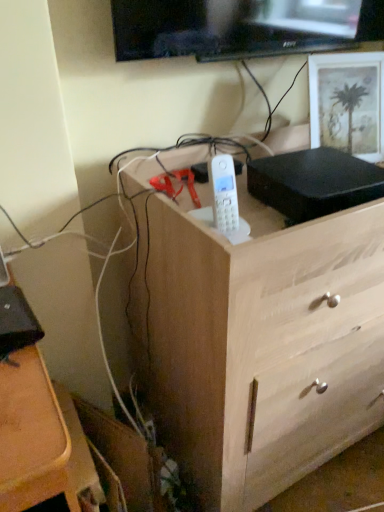
This screenshot has height=512, width=384. What do you see at coordinates (259, 342) in the screenshot?
I see `wooden chest of drawers at center` at bounding box center [259, 342].

Measure the distance between point [381,224] and camera.

The distance of point [381,224] from camera is 33.31 inches.

Where is `wooden chest of drawers at center`? This screenshot has height=512, width=384. wooden chest of drawers at center is located at coordinates (259, 342).

What is the approximate height of wooden chest of drawers at center?

It is 36.06 inches.

In order to face wooden chest of drawers at center, should I rotate leftwards or rightwards?

To align with it, rotate right about 13.432°.

This screenshot has height=512, width=384. Identify the location of white matte picture frame at upper right. (348, 103).

The width and height of the screenshot is (384, 512). What do you see at coordinates (348, 103) in the screenshot?
I see `white matte picture frame at upper right` at bounding box center [348, 103].

At what (x,y) coordinates should I click in order to perform the action: click on wooden chest of drawers at center. Please return your answer as a coordinate pair (x, y). Looking at the image, I should click on (259, 342).

Between white matte picture frame at upper right and wooden chest of drawers at center, which one appears on the left side from the viewer's perspective?

wooden chest of drawers at center.

Considering the positions of objects white matte picture frame at upper right and wooden chest of drawers at center in the image provided, who is behind, white matte picture frame at upper right or wooden chest of drawers at center?

white matte picture frame at upper right is further from the camera.

Considering the points (310, 106) and (218, 346), which point is behind, point (310, 106) or point (218, 346)?

The point (310, 106) is farther.

From the image's perspective, who appears lower, white matte picture frame at upper right or wooden chest of drawers at center?

wooden chest of drawers at center is shown below in the image.

From a real-world perspective, between white matte picture frame at upper right and wooden chest of drawers at center, who is vertically higher?

In real-world perspective, white matte picture frame at upper right is above.

In the scene shown: Is white matte picture frame at upper right thinner than wooden chest of drawers at center?

Yes.

Considering the sizes of objects white matte picture frame at upper right and wooden chest of drawers at center in the image provided, who is shorter, white matte picture frame at upper right or wooden chest of drawers at center?

With less height is white matte picture frame at upper right.

Considering the sizes of objects white matte picture frame at upper right and wooden chest of drawers at center in the image provided, who is smaller, white matte picture frame at upper right or wooden chest of drawers at center?

With smaller size is white matte picture frame at upper right.

Can wooden chest of drawers at center be found inside white matte picture frame at upper right?

No, wooden chest of drawers at center is not a part of white matte picture frame at upper right.

Based on the photo, are white matte picture frame at upper right and wooden chest of drawers at center far apart?

No, white matte picture frame at upper right is not far from wooden chest of drawers at center.

Is white matte picture frame at upper right oriented away from wooden chest of drawers at center?

No, wooden chest of drawers at center is not at the back of white matte picture frame at upper right.

What's the angular difference between white matte picture frame at upper right and wooden chest of drawers at center's facing directions?

white matte picture frame at upper right and wooden chest of drawers at center are facing 17.4 degrees away from each other.

How distant is white matte picture frame at upper right from wooden chest of drawers at center?

20.15 inches.

Find the location of `picture frame above the wooden chest of drawers at center (from a real-world perspective)`. picture frame above the wooden chest of drawers at center (from a real-world perspective) is located at coordinates (348, 103).

In the image, is wooden chest of drawers at center on the left side or the right side of white matte picture frame at upper right?

Based on their positions, wooden chest of drawers at center is located to the left of white matte picture frame at upper right.

Considering the positions of objects wooden chest of drawers at center and white matte picture frame at upper right in the image provided, who is in front, wooden chest of drawers at center or white matte picture frame at upper right?

wooden chest of drawers at center.

Between point (280, 367) and point (316, 135), which one is positioned in front?

The point (280, 367) is closer to the camera.

From the image's perspective, is wooden chest of drawers at center on top of white matte picture frame at upper right?

No.

Consider the image. From a real-world perspective, who is located higher, wooden chest of drawers at center or white matte picture frame at upper right?

From a 3D spatial view, white matte picture frame at upper right is above.

Which of these two, wooden chest of drawers at center or white matte picture frame at upper right, is wider?

With larger width is wooden chest of drawers at center.

Based on the photo, from their relative heights in the image, would you say wooden chest of drawers at center is taller or shorter than white matte picture frame at upper right?

In the image, wooden chest of drawers at center appears to be taller than white matte picture frame at upper right.

Between wooden chest of drawers at center and white matte picture frame at upper right, which one has larger size?

wooden chest of drawers at center.

Consider the image. Is white matte picture frame at upper right inside wooden chest of drawers at center?

Yes, white matte picture frame at upper right is surrounded by wooden chest of drawers at center.

Is wooden chest of drawers at center touching white matte picture frame at upper right?

No, wooden chest of drawers at center is not making contact with white matte picture frame at upper right.

Is wooden chest of drawers at center oriented towards white matte picture frame at upper right?

No, wooden chest of drawers at center is not oriented towards white matte picture frame at upper right.

Image resolution: width=384 pixels, height=512 pixels. I want to click on picture frame above the wooden chest of drawers at center (from the image's perspective), so click(x=348, y=103).

You are a GUI agent. You are given a task and a screenshot of the screen. Output one action in this format:
    pyautogui.click(x=<x>, y=<y>)
    Task: Click on the chest of drawers below the white matte picture frame at upper right (from the image's perspective)
    The width and height of the screenshot is (384, 512).
    Given the screenshot: What is the action you would take?
    pyautogui.click(x=259, y=342)

Image resolution: width=384 pixels, height=512 pixels. In order to click on chest of drawers in front of the white matte picture frame at upper right in this screenshot , I will do `click(259, 342)`.